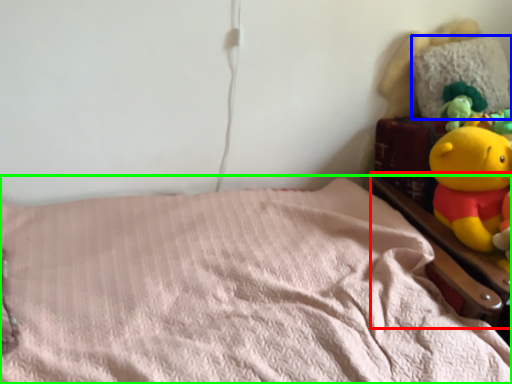
Question: Estimate the real-world distances between objects in this image. Which object is farther from bed frame (highlighted by a red box), pillow (highlighted by a blue box) or bed (highlighted by a green box)?

Choices:
 (A) pillow
 (B) bed

Answer: (A)